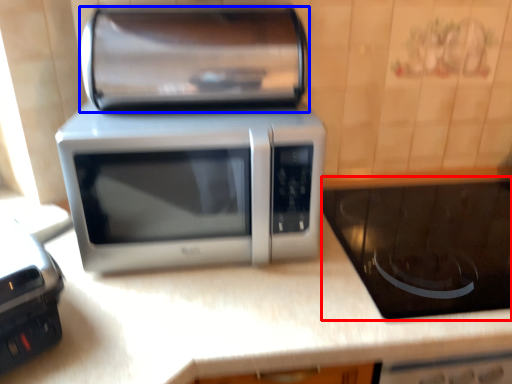
Question: Among these objects, which one is nearest to the camera, appliance (highlighted by a red box) or stereo (highlighted by a blue box)?

Choices:
 (A) appliance
 (B) stereo

Answer: (B)